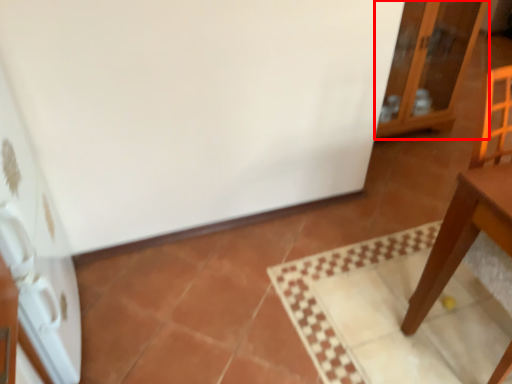
Question: From the image's perspective, where is cabinetry (annotated by the red box) located relative to appliance?

Choices:
 (A) below
 (B) above

Answer: (B)